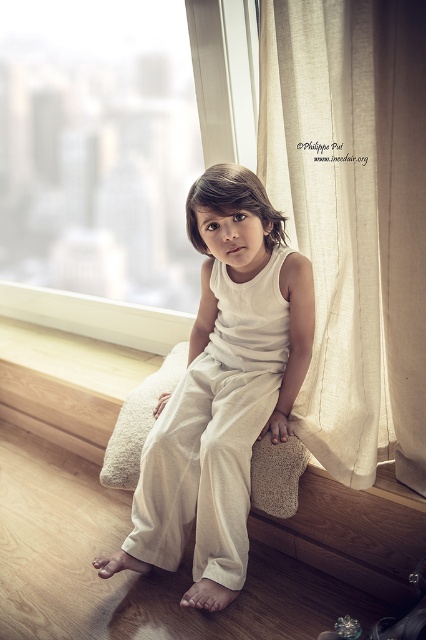
Identify the location of transparent glass window at center. The height and width of the screenshot is (640, 426). (115, 156).

Which is behind, point (181, 92) or point (101, 452)?

Point (101, 452)

Between point (150, 349) and point (54, 355), which one is positioned behind?

The point (54, 355) is behind.

You are a GUI agent. You are given a task and a screenshot of the screen. Output one action in this format:
    pyautogui.click(x=<x>, y=<y>)
    Task: Click on the transparent glass window at center
    
    Given the screenshot: What is the action you would take?
    pyautogui.click(x=115, y=156)

How distant is transparent glass window at center from white sheer curtain at center?

transparent glass window at center is 3.36 feet from white sheer curtain at center.

Is point (207, 81) closer to viewer compared to point (325, 188)?

No, (207, 81) is further to viewer.

Where is `transparent glass window at center`? The width and height of the screenshot is (426, 640). transparent glass window at center is located at coordinates (115, 156).

Does white sheer curtain at center have a greater height compared to white cotton pants at center?

Yes, white sheer curtain at center is taller than white cotton pants at center.

Where is `white sheer curtain at center`? This screenshot has width=426, height=640. white sheer curtain at center is located at coordinates (353, 218).

At what (x,y) coordinates should I click in order to perform the action: click on white sheer curtain at center. Please return your answer as a coordinate pair (x, y). The width and height of the screenshot is (426, 640). Looking at the image, I should click on (353, 218).